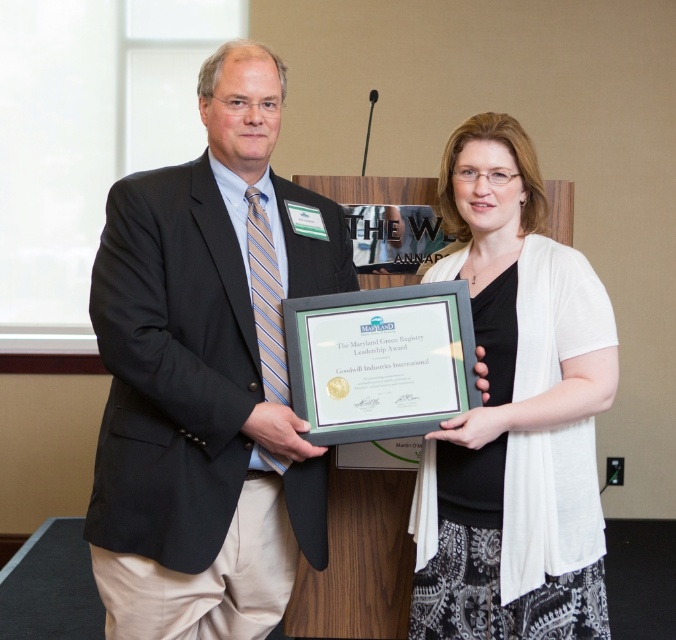
Question: Is matte black suit at center above white textured cardigan at center?

Choices:
 (A) yes
 (B) no

Answer: (A)

Question: Does matte black suit at center appear under white textured cardigan at center?

Choices:
 (A) no
 (B) yes

Answer: (A)

Question: Does matte black suit at center have a lesser width compared to white textured cardigan at center?

Choices:
 (A) no
 (B) yes

Answer: (A)

Question: Which point is farther to the camera?

Choices:
 (A) matte black suit at center
 (B) white textured cardigan at center

Answer: (B)

Question: Which of the following is the farthest from the observer?

Choices:
 (A) white textured cardigan at center
 (B) matte black suit at center

Answer: (A)